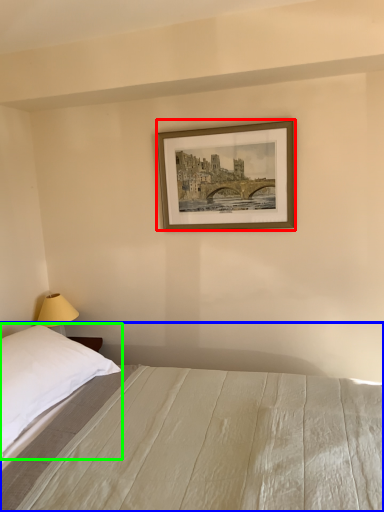
Question: Estimate the real-world distances between objects in this image. Which object is farther from picture frame (highlighted by a red box), bed (highlighted by a blue box) or pillow (highlighted by a green box)?

Choices:
 (A) bed
 (B) pillow

Answer: (B)